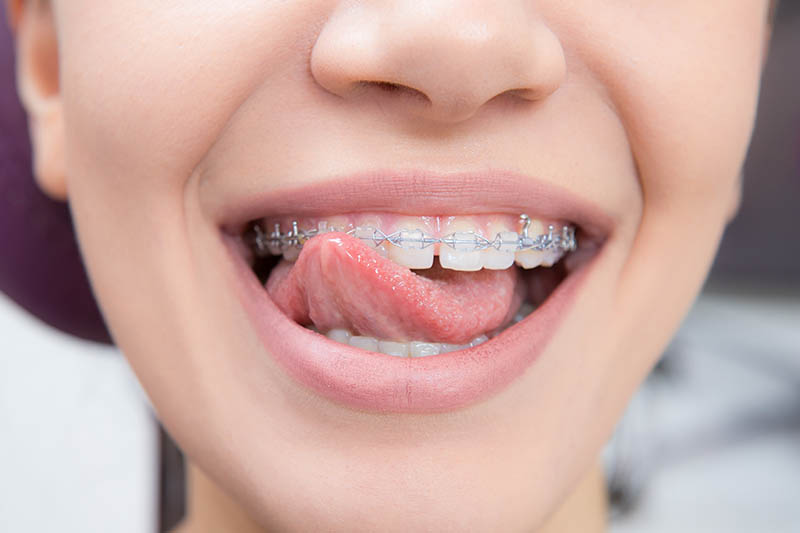
You are a GUI agent. You are given a task and a screenshot of the screen. Output one action in this format:
    pyautogui.click(x=<x>, y=<y>)
    Task: Click on the bucket
    This screenshot has width=800, height=533.
    Given the screenshot: What is the action you would take?
    pyautogui.click(x=21, y=266)